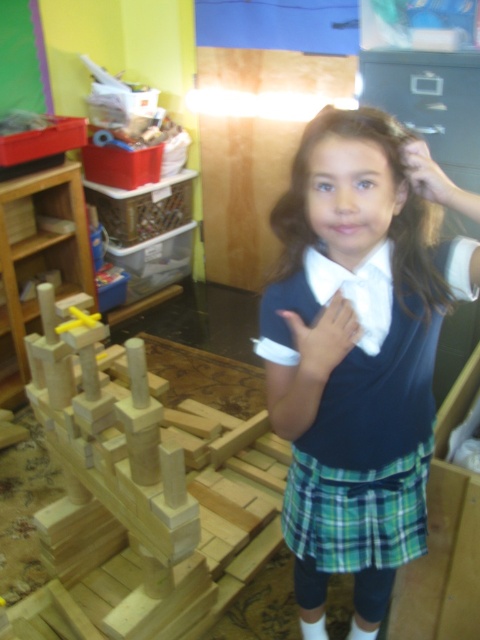
Question: Which point is closer to the camera?

Choices:
 (A) matte blue sweater at center
 (B) brown silky hair at center
 (C) plaid fabric skirt at center
 (D) natural wood blocks at left

Answer: (A)

Question: Can you confirm if matte blue sweater at center is positioned to the right of brown silky hair at center?

Choices:
 (A) no
 (B) yes

Answer: (B)

Question: Estimate the real-world distances between objects in this image. Which object is farther from the plaid fabric skirt at center?

Choices:
 (A) natural wood blocks at left
 (B) matte blue sweater at center
 (C) brown silky hair at center

Answer: (A)

Question: Which point is farther to the camera?

Choices:
 (A) plaid fabric skirt at center
 (B) brown silky hair at center

Answer: (A)

Question: Can you confirm if matte blue sweater at center is smaller than brown silky hair at center?

Choices:
 (A) yes
 (B) no

Answer: (B)

Question: Can you confirm if natural wood blocks at left is bigger than brown silky hair at center?

Choices:
 (A) yes
 (B) no

Answer: (A)